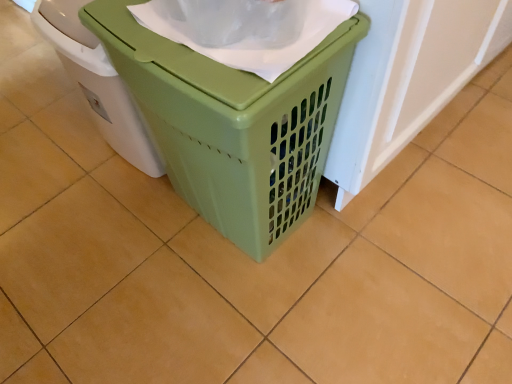
Question: Is green plastic laundry basket at center, the second waste container from the right, in front of or behind green plastic laundry basket at center, acting as the first waste container starting from the right, in the image?

Choices:
 (A) behind
 (B) front

Answer: (A)

Question: Based on their sizes in the image, would you say green plastic laundry basket at center, arranged as the first waste container when viewed from the left, is bigger or smaller than green plastic laundry basket at center, positioned as the 2th waste container in left-to-right order?

Choices:
 (A) big
 (B) small

Answer: (B)

Question: From a real-world perspective, is green plastic laundry basket at center, the second waste container from the right, physically located above or below green plastic laundry basket at center, acting as the first waste container starting from the right?

Choices:
 (A) below
 (B) above

Answer: (A)

Question: Is point (311, 100) closer or farther from the camera than point (74, 11)?

Choices:
 (A) farther
 (B) closer

Answer: (B)

Question: Based on their positions, is green plastic laundry basket at center, acting as the first waste container starting from the right, located to the left or right of green plastic laundry basket at center, the second waste container from the right?

Choices:
 (A) right
 (B) left

Answer: (A)

Question: Considering the positions of green plastic laundry basket at center, positioned as the 2th waste container in left-to-right order, and green plastic laundry basket at center, the second waste container from the right, in the image, is green plastic laundry basket at center, positioned as the 2th waste container in left-to-right order, bigger or smaller than green plastic laundry basket at center, the second waste container from the right,?

Choices:
 (A) small
 (B) big

Answer: (B)

Question: From the image's perspective, is green plastic laundry basket at center, acting as the first waste container starting from the right, positioned above or below green plastic laundry basket at center, the second waste container from the right?

Choices:
 (A) below
 (B) above

Answer: (A)